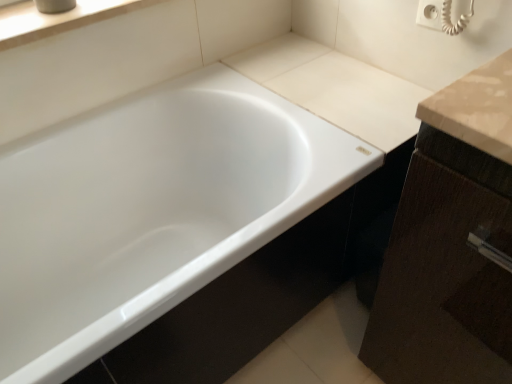
Question: In terms of size, does white glossy bathtub at center appear bigger or smaller than white smooth window sill at upper left?

Choices:
 (A) small
 (B) big

Answer: (B)

Question: Would you say white glossy bathtub at center is to the left or to the right of white smooth window sill at upper left in the picture?

Choices:
 (A) left
 (B) right

Answer: (B)

Question: From a real-world perspective, is white glossy bathtub at center physically located above or below white smooth window sill at upper left?

Choices:
 (A) below
 (B) above

Answer: (A)

Question: In terms of height, does white smooth window sill at upper left look taller or shorter compared to white glossy bathtub at center?

Choices:
 (A) short
 (B) tall

Answer: (A)

Question: From a real-world perspective, is white smooth window sill at upper left above or below white glossy bathtub at center?

Choices:
 (A) above
 (B) below

Answer: (A)

Question: In terms of size, does white smooth window sill at upper left appear bigger or smaller than white glossy bathtub at center?

Choices:
 (A) small
 (B) big

Answer: (A)

Question: Choose the correct answer: Is white smooth window sill at upper left inside white glossy bathtub at center or outside it?

Choices:
 (A) inside
 (B) outside

Answer: (B)